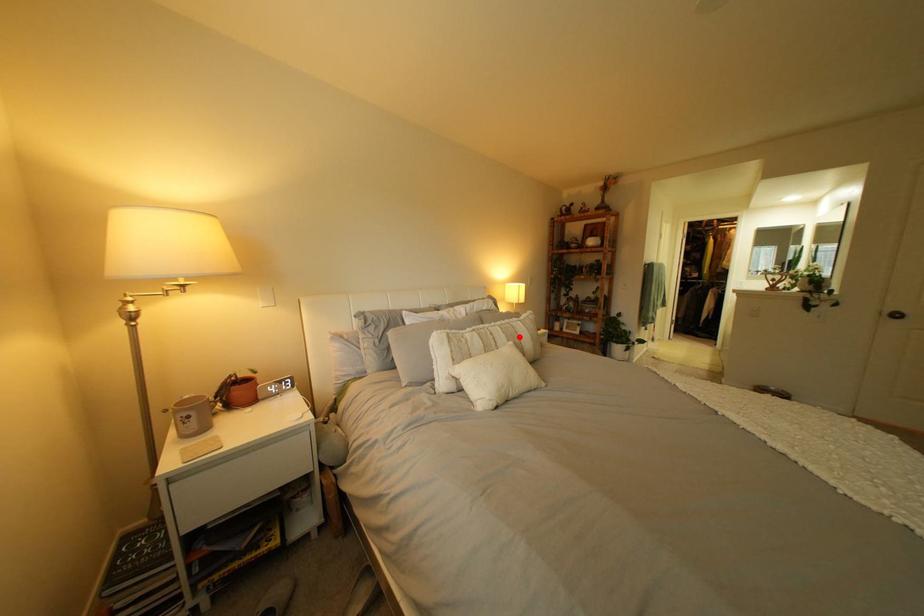
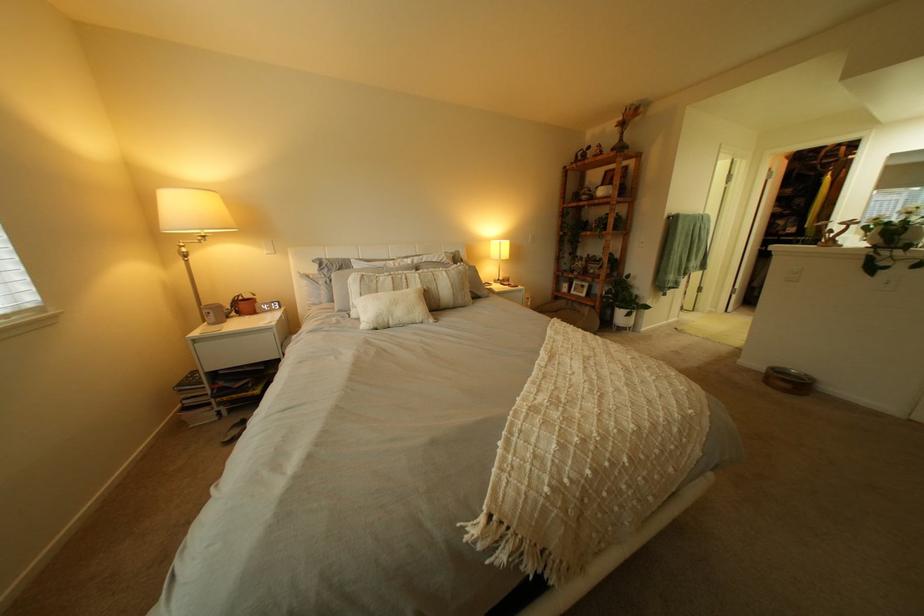
Question: I am providing you with two images of the same scene from different viewpoints. Image1 has a red point marked. In image2, the corresponding 3D location appears at what relative position? Reply with the corresponding letter.

Choices:
 (A) Closer
 (B) Farther

Answer: (A)